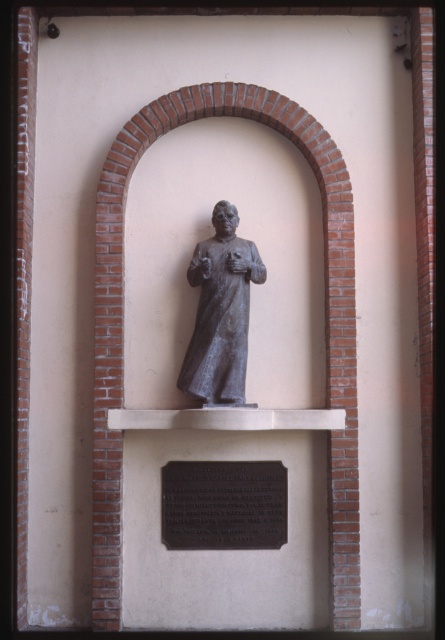
Question: Does bronze plaque at center appear on the right side of bronze statue at center?

Choices:
 (A) no
 (B) yes

Answer: (A)

Question: Considering the relative positions of bronze plaque at center and bronze statue at center in the image provided, where is bronze plaque at center located with respect to bronze statue at center?

Choices:
 (A) below
 (B) above

Answer: (A)

Question: Does bronze plaque at center have a smaller size compared to bronze statue at center?

Choices:
 (A) yes
 (B) no

Answer: (A)

Question: Which object appears closest to the camera in this image?

Choices:
 (A) bronze plaque at center
 (B) bronze statue at center

Answer: (B)

Question: Among these objects, which one is farthest from the camera?

Choices:
 (A) bronze statue at center
 (B) bronze plaque at center

Answer: (B)